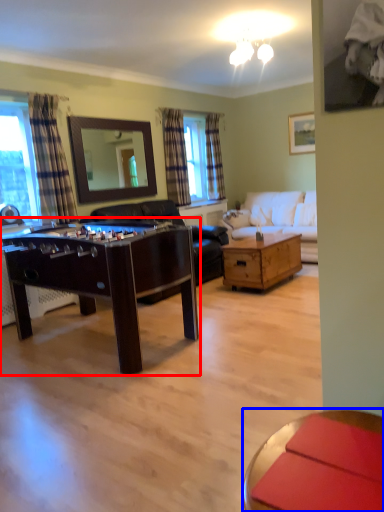
Question: Which object appears farthest to the camera in this image, table (highlighted by a red box) or coffee table (highlighted by a blue box)?

Choices:
 (A) table
 (B) coffee table

Answer: (A)